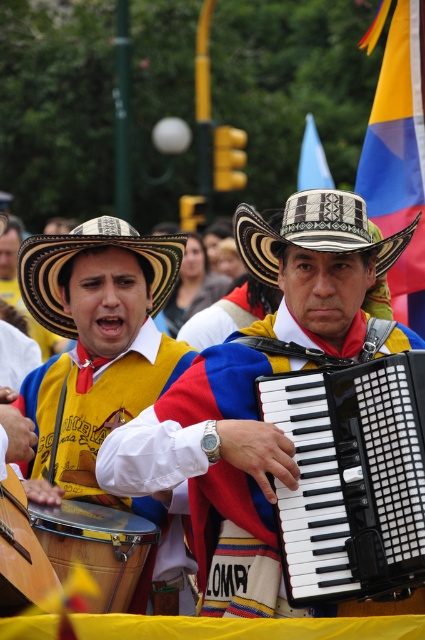
Is point (408, 13) behind point (152, 236)?

Yes, point (408, 13) is farther from viewer.

Between yellow fabric flag at upper right and natural straw cowboy hat at center, which one has more height?

yellow fabric flag at upper right is taller.

Find the location of a particular element. yellow fabric flag at upper right is located at coordinates (399, 156).

Is black plastic accordion at center smaller than natural straw cowboy hat at center?

Indeed, black plastic accordion at center has a smaller size compared to natural straw cowboy hat at center.

Between point (255, 381) and point (158, 266), which one is positioned in front?

Point (255, 381) is more forward.

This screenshot has height=640, width=425. What are the coordinates of `black plastic accordion at center` in the screenshot? It's located at (351, 477).

Can you confirm if matte yellow vest at center is smaller than natural straw cowboy hat at center?

Correct, matte yellow vest at center occupies less space than natural straw cowboy hat at center.

Is point (149, 353) farther from camera compared to point (56, 244)?

Yes, point (149, 353) is behind point (56, 244).

What do you see at coordinates (98, 344) in the screenshot? Image resolution: width=425 pixels, height=640 pixels. I see `matte yellow vest at center` at bounding box center [98, 344].

The image size is (425, 640). I want to click on matte yellow vest at center, so [x=98, y=344].